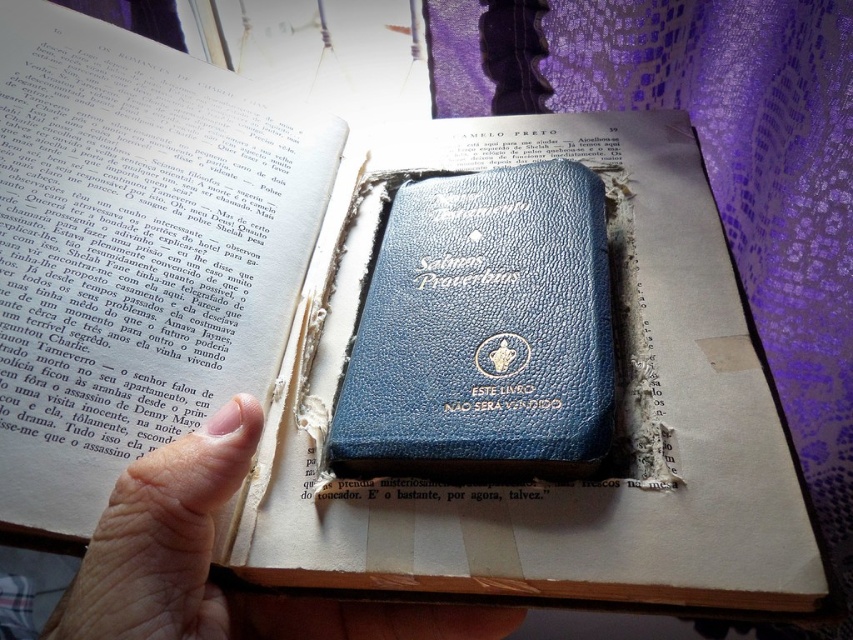
Question: Does blue leather book at center come behind skinny flesh hand at center?

Choices:
 (A) yes
 (B) no

Answer: (A)

Question: Which point appears closest to the camera in this image?

Choices:
 (A) (213, 513)
 (B) (503, 294)

Answer: (A)

Question: Which object appears closest to the camera in this image?

Choices:
 (A) blue leather book at center
 (B) skinny flesh hand at center

Answer: (B)

Question: Is blue leather book at center smaller than skinny flesh hand at center?

Choices:
 (A) no
 (B) yes

Answer: (A)

Question: Is blue leather book at center wider than skinny flesh hand at center?

Choices:
 (A) yes
 (B) no

Answer: (B)